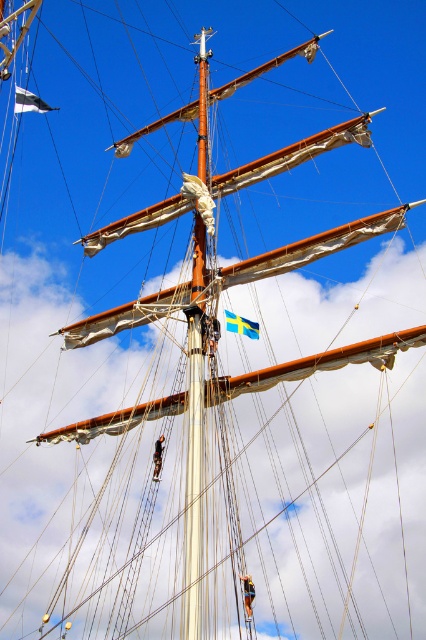
You are a sailor on the ship looking at the mast. There is a point marked at coordinates (29,100). What object is located at that point?

The point at coordinates (29,100) marks the location of the white fabric flag at upper left.

You are a sailor on the deck of the ship looking up at the mast. You see the white fabric flag at upper left and the blue fabric flag at upper center. Which flag appears closer to you?

The white fabric flag at upper left appears closer to you because the blue fabric flag at upper center is behind it.

You are a sailor on the ship and need to determine the position of two points on the mast. Which point is closer to you, point (43, 109) or point (236, 330)?

Point (43, 109) is closer to you than point (236, 330) because it is further to the camera.